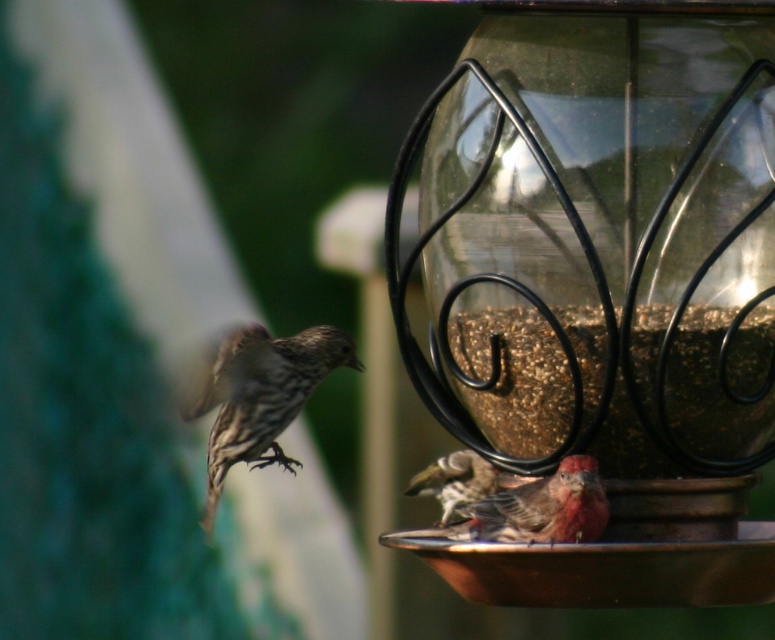
Can you confirm if rusty brown feathers at lower center is shorter than brown speckled feathers at lower center?

Yes.

I want to click on rusty brown feathers at lower center, so click(541, 508).

Is brown textured seeds at center smaller than brown speckled feathers at lower center?

No.

Which of these two, brown textured seeds at center or brown speckled feathers at lower center, stands taller?

brown textured seeds at center

Is point (684, 356) behind point (457, 483)?

That is False.

You are a GUI agent. You are given a task and a screenshot of the screen. Output one action in this format:
    pyautogui.click(x=<x>, y=<y>)
    Task: Click on the brown textured seeds at center
    
    Given the screenshot: What is the action you would take?
    pyautogui.click(x=515, y=380)

How far apart are translucent glass bird feeder at center and rusty brown feathers at lower center?

They are 18.67 centimeters apart.

Describe the element at coordinates (603, 288) in the screenshot. I see `translucent glass bird feeder at center` at that location.

At what (x,y) coordinates should I click in order to perform the action: click on translucent glass bird feeder at center. Please return your answer as a coordinate pair (x, y). Looking at the image, I should click on (603, 288).